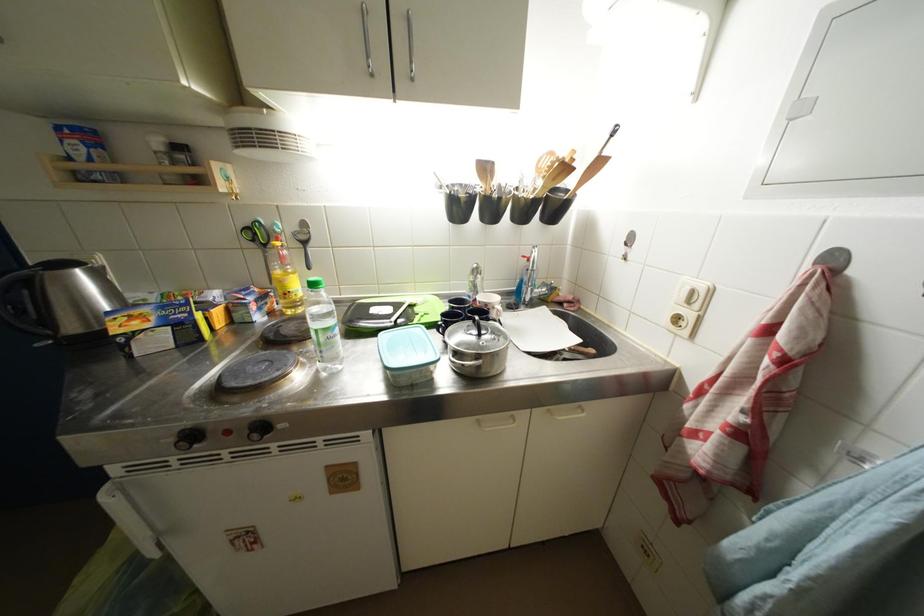
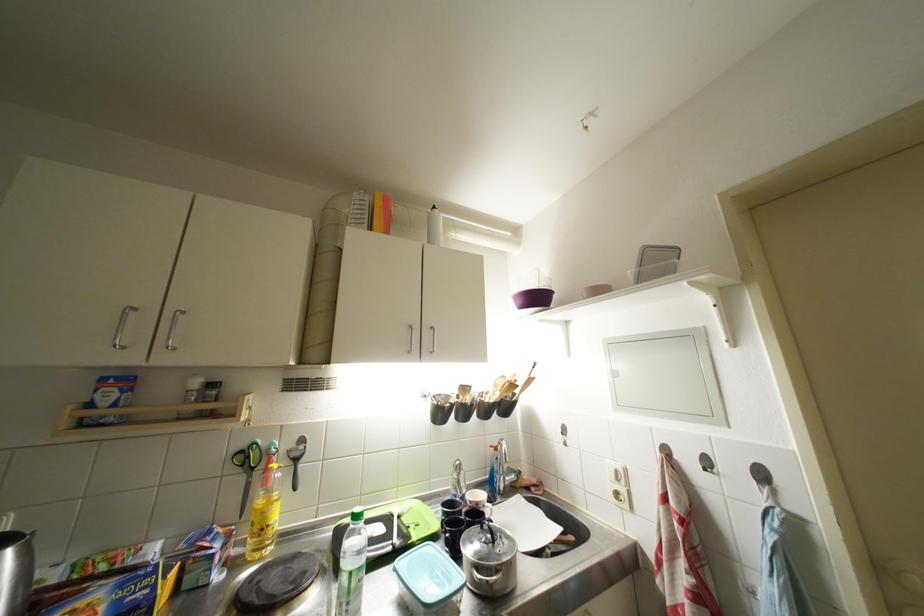
The images are taken continuously from a first-person perspective. In which direction is your viewpoint rotating?

The camera rotated toward right-up.